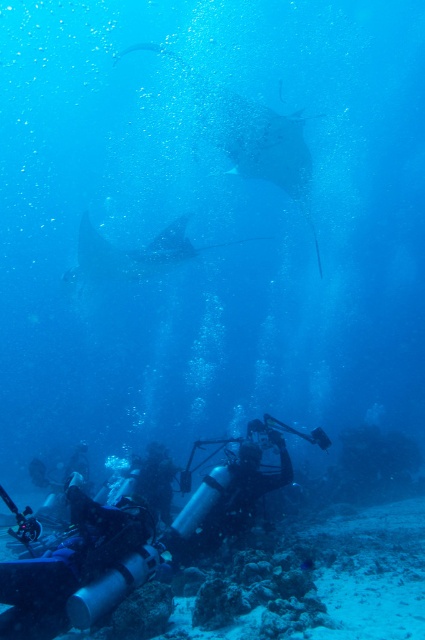
Question: Is black rubber diving suit at lower center smaller than smooth gray stingray at center?

Choices:
 (A) yes
 (B) no

Answer: (A)

Question: Is the position of black rubber diving suit at lower center less distant than that of smooth gray stingray at center?

Choices:
 (A) no
 (B) yes

Answer: (B)

Question: Which of the following is the closest to the observer?

Choices:
 (A) black rubber diving suit at lower center
 (B) smooth gray stingray at center

Answer: (A)

Question: Which point appears farthest from the camera in this image?

Choices:
 (A) (240, 493)
 (B) (95, 236)

Answer: (B)

Question: Does black rubber diving suit at lower center appear under smooth gray stingray at center?

Choices:
 (A) no
 (B) yes

Answer: (B)

Question: Which point appears closest to the camera in this image?

Choices:
 (A) (240, 448)
 (B) (180, 237)

Answer: (A)